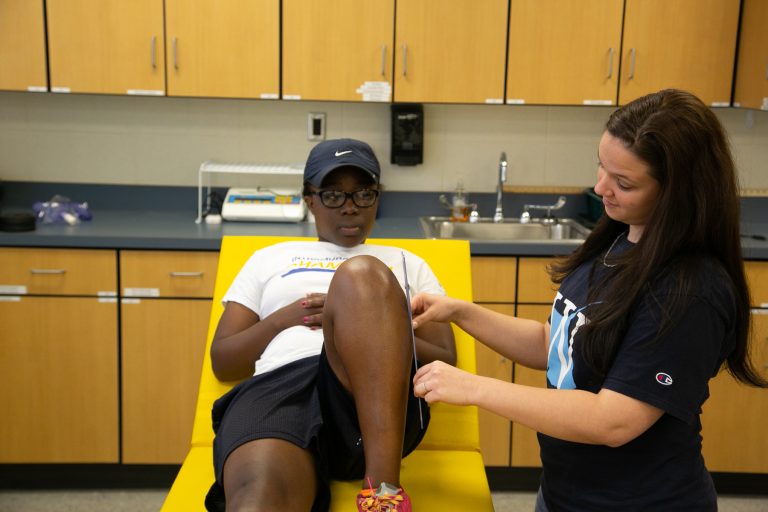
At what (x,y) coordinates should I click in order to perform the action: click on faucet. Please return your answer as a coordinate pair (x, y). The width and height of the screenshot is (768, 512). Looking at the image, I should click on (502, 161).